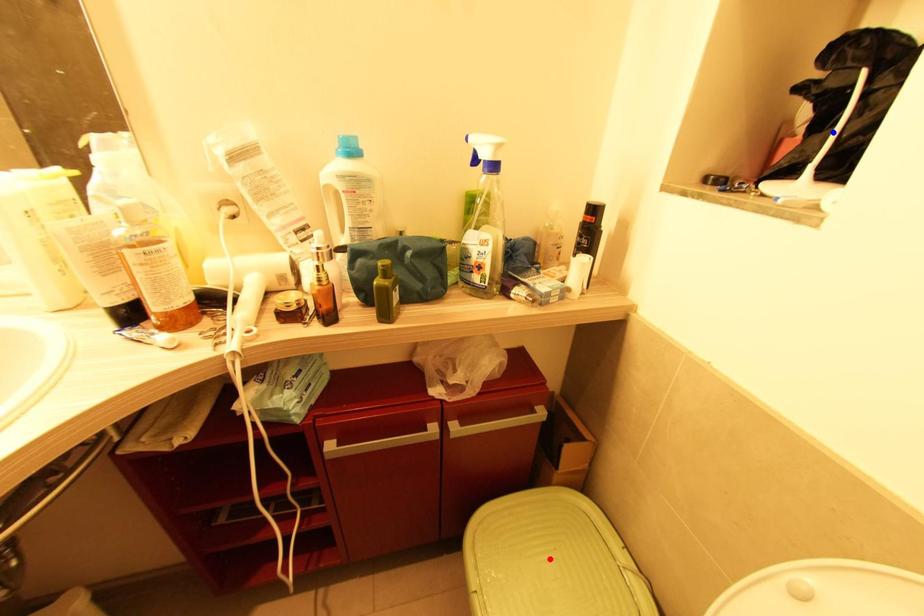
Question: Two points are marked on the image. Which point is closer to the camera?

Choices:
 (A) Blue point is closer.
 (B) Red point is closer.

Answer: (A)